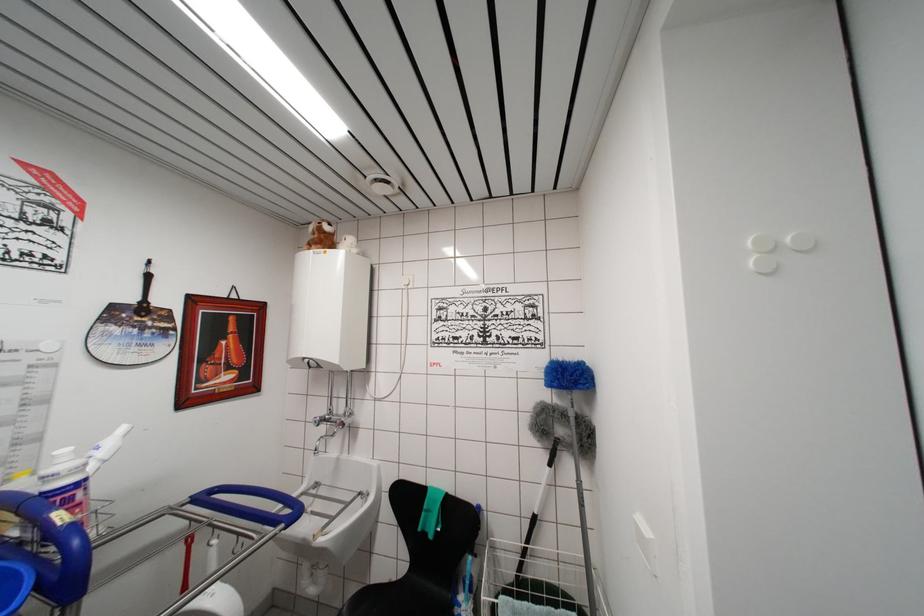
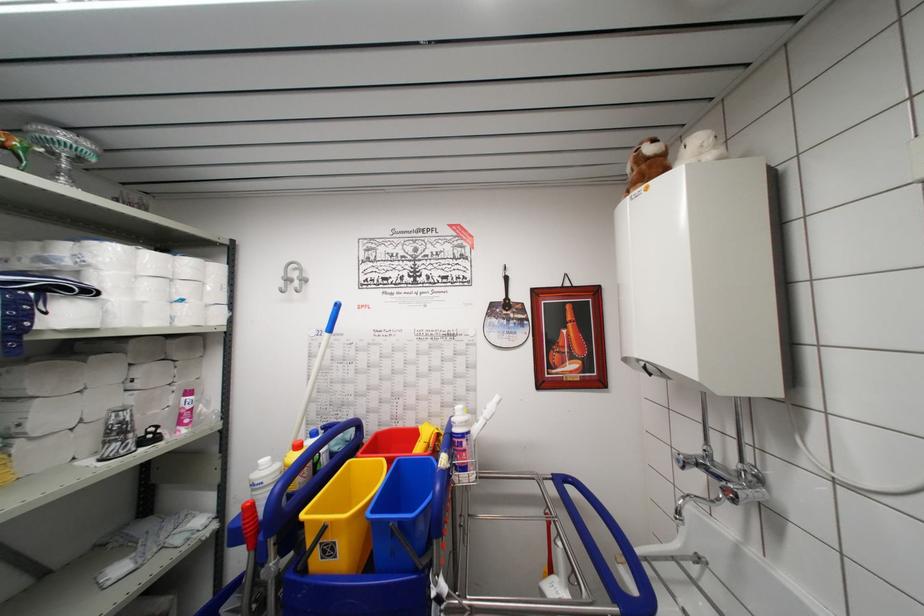
Question: The first image is from the beginning of the video and the second image is from the end. How did the camera likely rotate when shooting the video?

Choices:
 (A) Left
 (B) Right
 (C) Up
 (D) Down

Answer: (A)